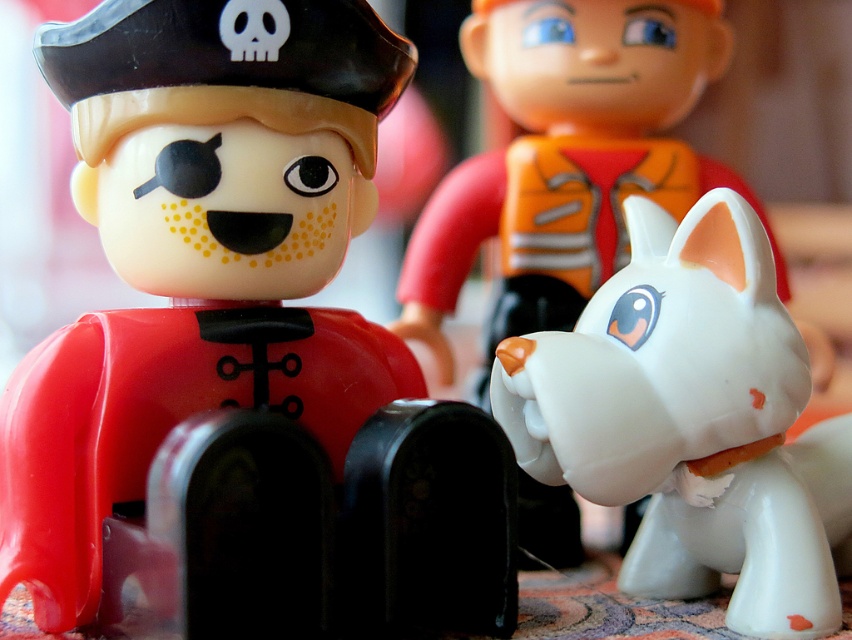
Question: Based on their relative distances, which object is nearer to the white glossy dog at center?

Choices:
 (A) white matte dog at center
 (B) matte black pirate hat at upper left

Answer: (B)

Question: Is matte black pirate hat at upper left below white matte dog at center?

Choices:
 (A) no
 (B) yes

Answer: (B)

Question: Estimate the real-world distances between objects in this image. Which object is farther from the matte black pirate hat at upper left?

Choices:
 (A) white matte dog at center
 (B) white glossy dog at center

Answer: (A)

Question: Is matte black pirate hat at upper left wider than white glossy dog at center?

Choices:
 (A) no
 (B) yes

Answer: (B)

Question: Which point is closer to the camera taking this photo?

Choices:
 (A) (849, 458)
 (B) (462, 209)

Answer: (A)

Question: Where is white glossy dog at center located in relation to white matte dog at center in the image?

Choices:
 (A) below
 (B) above

Answer: (A)